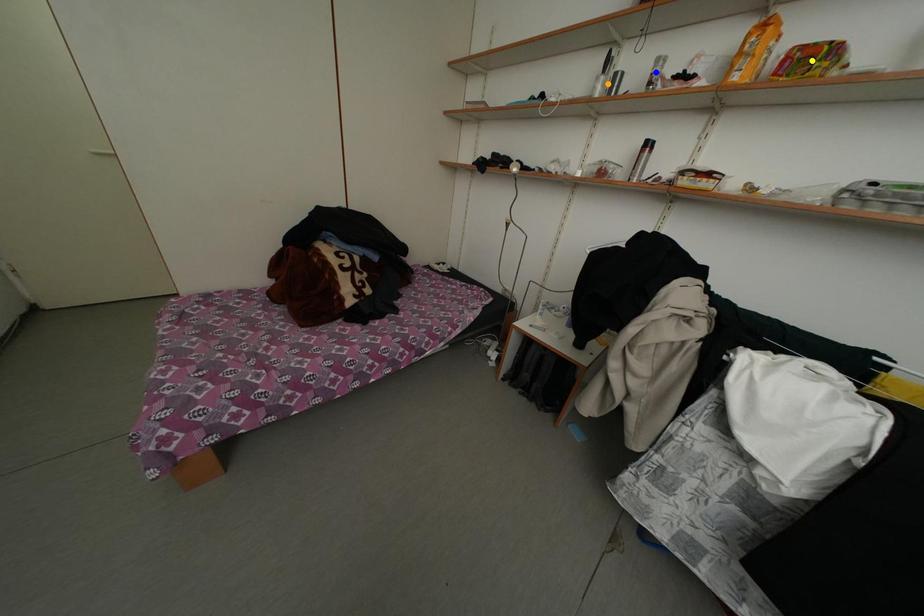
Consider the image. Order these from nearest to farthest:
1. yellow point
2. blue point
3. orange point

1. yellow point
2. blue point
3. orange point